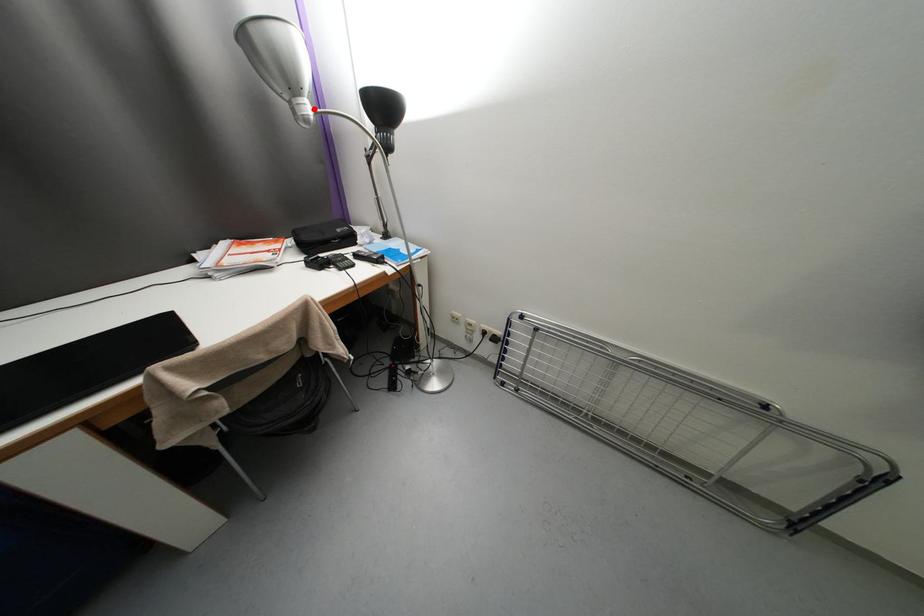
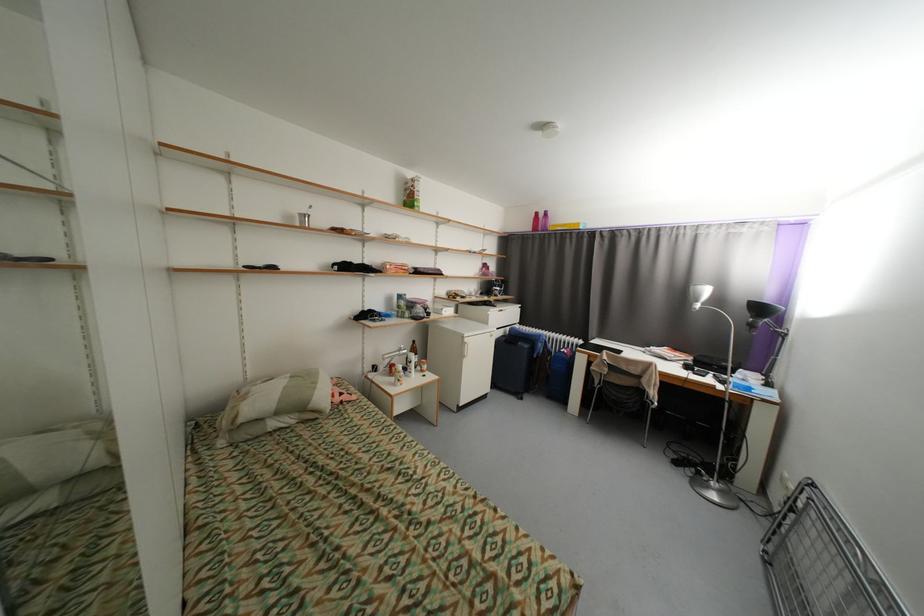
Locate, in the second image, the point that corresponds to the highlighted location in the first image.

(703, 306)